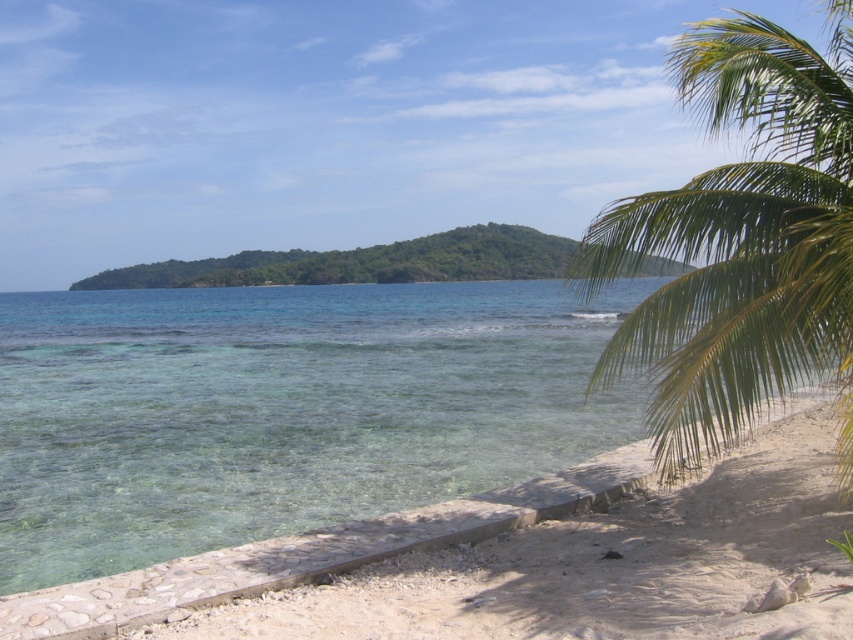
Question: Which object is the farthest from the green leafy palm tree at right?

Choices:
 (A) green leafy island at center
 (B) white sandy beach at lower right

Answer: (A)

Question: Which of the following is the closest to the observer?

Choices:
 (A) green leafy palm tree at right
 (B) white sandy beach at lower right
 (C) green leafy island at center

Answer: (B)

Question: Can you confirm if white sandy beach at lower right is positioned to the left of green leafy island at center?

Choices:
 (A) no
 (B) yes

Answer: (A)

Question: Which point is farther to the camera?

Choices:
 (A) (538, 260)
 (B) (807, 372)

Answer: (A)

Question: Does green leafy palm tree at right appear over green leafy island at center?

Choices:
 (A) no
 (B) yes

Answer: (B)

Question: Is green leafy palm tree at right bigger than green leafy island at center?

Choices:
 (A) no
 (B) yes

Answer: (B)